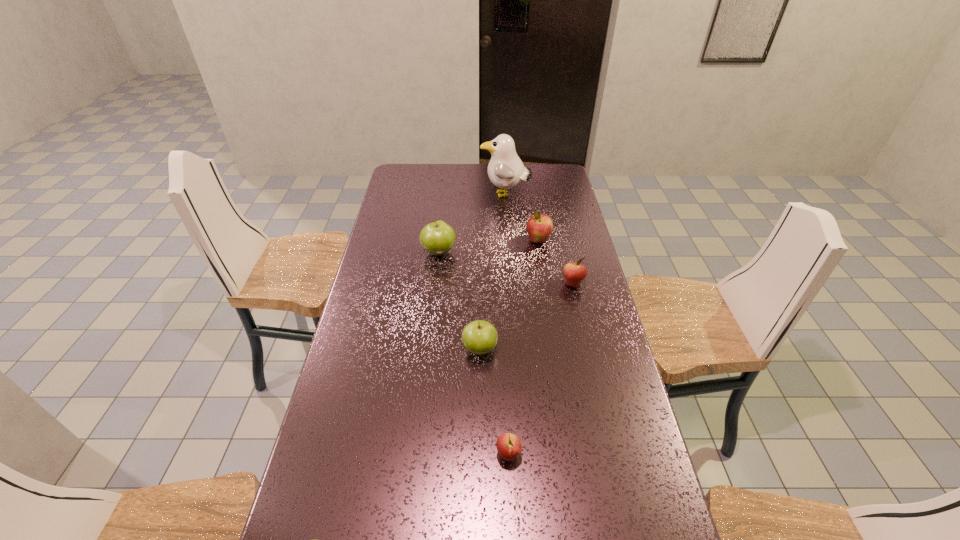
You are a GUI agent. You are given a task and a screenshot of the screen. Output one action in this format:
    pyautogui.click(x=<x>, y=<y>)
    Task: Click on the tallest object
    This screenshot has width=960, height=540.
    Given the screenshot: What is the action you would take?
    pyautogui.click(x=505, y=170)

You are a GUI agent. You are given a task and a screenshot of the screen. Output one action in this format:
    pyautogui.click(x=<x>, y=<y>)
    Task: Click on the farthest object
    The height and width of the screenshot is (540, 960).
    Given the screenshot: What is the action you would take?
    pyautogui.click(x=505, y=170)

In order to click on the farthest red apple in this screenshot , I will do click(x=539, y=227).

I want to click on the biggest red apple, so click(539, 227).

Find the location of a particular element. The height and width of the screenshot is (540, 960). the second green apple from left to right is located at coordinates (437, 238).

Find the location of `the sixth object from right to left`. the sixth object from right to left is located at coordinates (437, 238).

In order to click on the second biggest red apple in this screenshot , I will do `click(574, 273)`.

This screenshot has width=960, height=540. I want to click on the rightmost object, so click(574, 273).

Where is `the rightmost green apple`? The height and width of the screenshot is (540, 960). the rightmost green apple is located at coordinates (479, 337).

The image size is (960, 540). Identify the location of the fifth farthest object. [x=479, y=337].